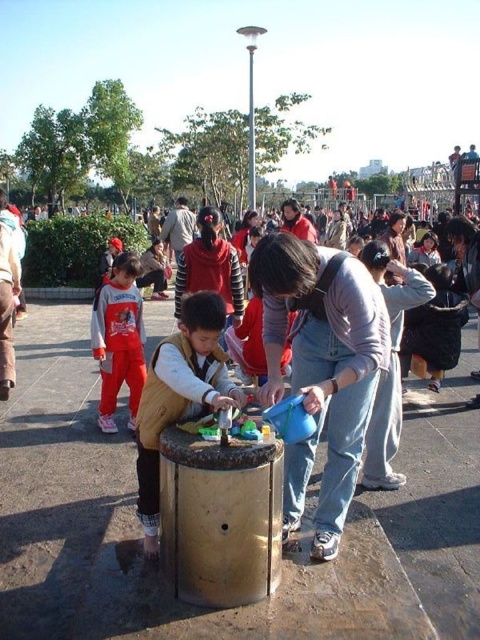
You are standing at the point closest to the camera in the image. Which point, point (343, 380) or point (183, 256), are you currently at?

You are at point (343, 380) because it is closer to the camera than point (183, 256).

You are a photographer trying to capture a candid shot of the light brown vest at center and the matte black jacket at center. Since you want to ensure both subjects are in focus, you need to know their heights. Which of the two is taller?

The light brown vest at center is taller than the matte black jacket at center, so the photographer should adjust the camera settings to accommodate the height difference for better focus.